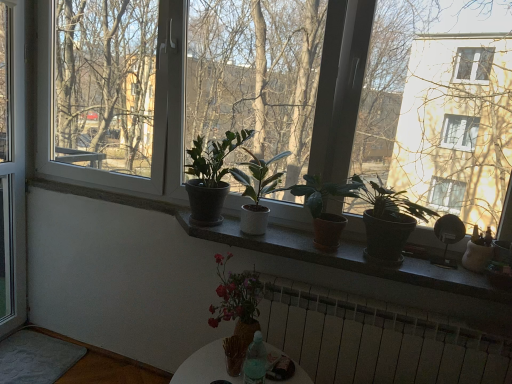
Where is `free location above matte concrete window sill at center (from a real-world perspective)`? This screenshot has width=512, height=384. free location above matte concrete window sill at center (from a real-world perspective) is located at coordinates tap(336, 248).